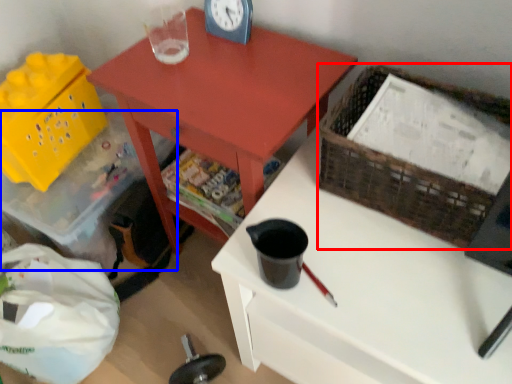
Question: Which object appears farthest to the camera in this image, basket (highlighted by a red box) or storage box (highlighted by a blue box)?

Choices:
 (A) basket
 (B) storage box

Answer: (B)